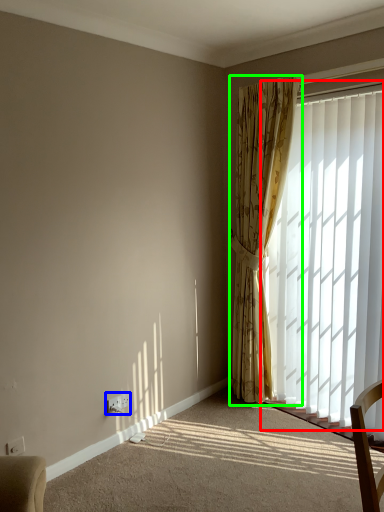
Question: Considering the real-world distances, which object is farthest from window (highlighted by a red box)? electric outlet (highlighted by a blue box) or curtain (highlighted by a green box)?

Choices:
 (A) electric outlet
 (B) curtain

Answer: (A)